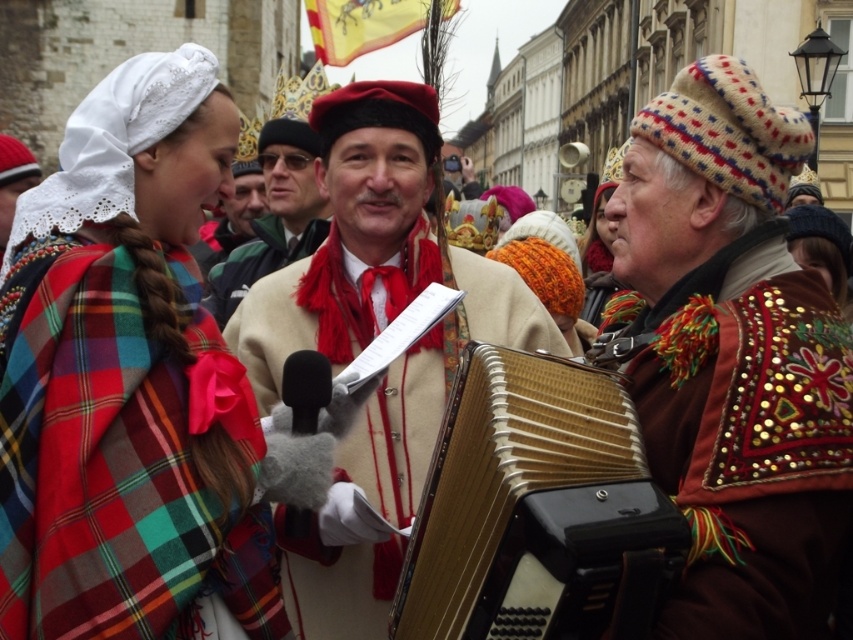
Question: Which object is positioned farthest from the shiny gold accordion at center?

Choices:
 (A) plaid fabric shawl at left
 (B) beige woolen coat at center
 (C) gold metallic accordion at center
 (D) beige wool coat at center

Answer: (D)

Question: Among these objects, which one is nearest to the camera?

Choices:
 (A) shiny gold accordion at center
 (B) beige wool coat at center
 (C) gold metallic accordion at center
 (D) beige woolen coat at center

Answer: (C)

Question: Based on their relative distances, which object is farther from the beige wool coat at center?

Choices:
 (A) plaid fabric shawl at left
 (B) gold metallic accordion at center
 (C) beige woolen coat at center

Answer: (B)

Question: From the image, what is the correct spatial relationship of shiny gold accordion at center in relation to beige wool coat at center?

Choices:
 (A) below
 (B) above

Answer: (A)

Question: Is plaid fabric shawl at left positioned before shiny gold accordion at center?

Choices:
 (A) no
 (B) yes

Answer: (A)

Question: Is beige woolen coat at center to the right of beige wool coat at center from the viewer's perspective?

Choices:
 (A) yes
 (B) no

Answer: (A)